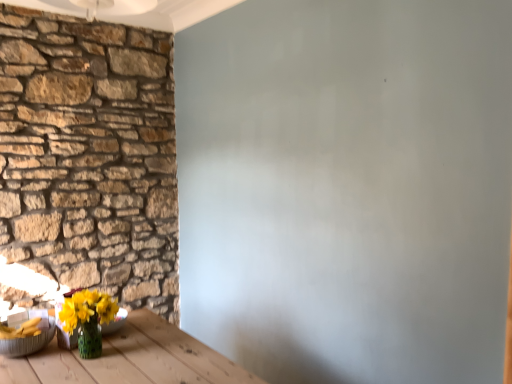
Question: Are translucent glass vase at lower left, which appears as the 2th bowl when viewed from the left, and natural stone wall at left located far from each other?

Choices:
 (A) yes
 (B) no

Answer: (A)

Question: From a real-world perspective, is translucent glass vase at lower left, positioned as the 1th bowl in right-to-left order, beneath natural stone wall at left?

Choices:
 (A) no
 (B) yes

Answer: (B)

Question: Does translucent glass vase at lower left, positioned as the 1th bowl in right-to-left order, have a smaller size compared to natural stone wall at left?

Choices:
 (A) yes
 (B) no

Answer: (A)

Question: Does translucent glass vase at lower left, positioned as the 1th bowl in right-to-left order, appear on the right side of natural stone wall at left?

Choices:
 (A) no
 (B) yes

Answer: (B)

Question: Is translucent glass vase at lower left, positioned as the 1th bowl in right-to-left order, not inside natural stone wall at left?

Choices:
 (A) no
 (B) yes

Answer: (B)

Question: Is metallic silver bowl at lower left, which is the second bowl in right-to-left order, bigger or smaller than translucent glass vase at lower left, which appears as the 2th bowl when viewed from the left?

Choices:
 (A) big
 (B) small

Answer: (A)

Question: Which is correct: metallic silver bowl at lower left, which is the second bowl in right-to-left order, is inside translucent glass vase at lower left, positioned as the 1th bowl in right-to-left order, or outside of it?

Choices:
 (A) inside
 (B) outside

Answer: (B)

Question: From a real-world perspective, is metallic silver bowl at lower left, the first bowl from the left, positioned above or below translucent glass vase at lower left, which appears as the 2th bowl when viewed from the left?

Choices:
 (A) above
 (B) below

Answer: (A)

Question: Does point (17, 352) appear closer or farther from the camera than point (115, 331)?

Choices:
 (A) farther
 (B) closer

Answer: (B)

Question: Relative to natural stone wall at left, is metallic silver bowl at lower left, the first bowl from the left, in front or behind?

Choices:
 (A) behind
 (B) front

Answer: (B)

Question: In terms of width, does metallic silver bowl at lower left, which is the second bowl in right-to-left order, look wider or thinner when compared to natural stone wall at left?

Choices:
 (A) thin
 (B) wide

Answer: (B)

Question: From the image's perspective, is metallic silver bowl at lower left, which is the second bowl in right-to-left order, above or below natural stone wall at left?

Choices:
 (A) above
 (B) below

Answer: (B)

Question: From a real-world perspective, is metallic silver bowl at lower left, which is the second bowl in right-to-left order, positioned above or below natural stone wall at left?

Choices:
 (A) below
 (B) above

Answer: (A)

Question: Is natural stone wall at left bigger or smaller than translucent glass vase at lower left, which appears as the 2th bowl when viewed from the left?

Choices:
 (A) big
 (B) small

Answer: (A)

Question: Is natural stone wall at left wider or thinner than translucent glass vase at lower left, positioned as the 1th bowl in right-to-left order?

Choices:
 (A) wide
 (B) thin

Answer: (B)